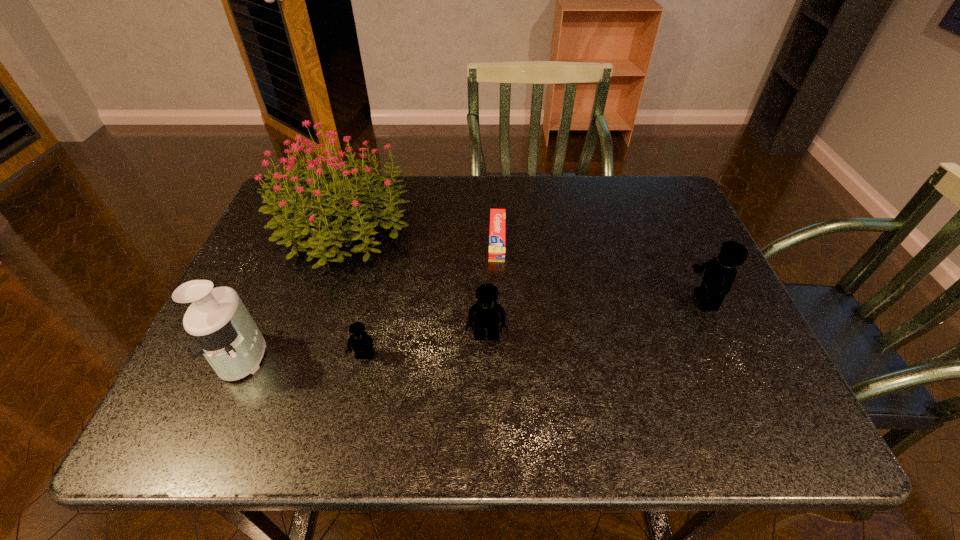
In the image, there is a desktop. Where is `free space at the far right corner`? This screenshot has height=540, width=960. free space at the far right corner is located at coordinates (628, 204).

Where is `free space at the near right corner of the desktop`? free space at the near right corner of the desktop is located at coordinates (753, 363).

Image resolution: width=960 pixels, height=540 pixels. I want to click on vacant point located between the nearest Lego and the juicer, so click(x=304, y=356).

Identify the location of empty space that is in between the fourth tallest object and the bouquet. (414, 282).

Where is `empty space that is in between the leftmost Lego and the rightmost Lego`? Image resolution: width=960 pixels, height=540 pixels. empty space that is in between the leftmost Lego and the rightmost Lego is located at coordinates (535, 328).

Identify the location of free space between the shortest Lego and the bouquet. (353, 292).

The image size is (960, 540). What are the coordinates of `free area in between the tallest object and the juicer` in the screenshot? It's located at pos(293,292).

The image size is (960, 540). I want to click on vacant space that's between the third shortest object and the leftmost Lego, so click(x=425, y=346).

This screenshot has width=960, height=540. Identify the location of free area in between the bouquet and the toothpaste. (420, 233).

The width and height of the screenshot is (960, 540). Identify the location of empty space that is in between the nearest Lego and the bouquet. (353, 292).